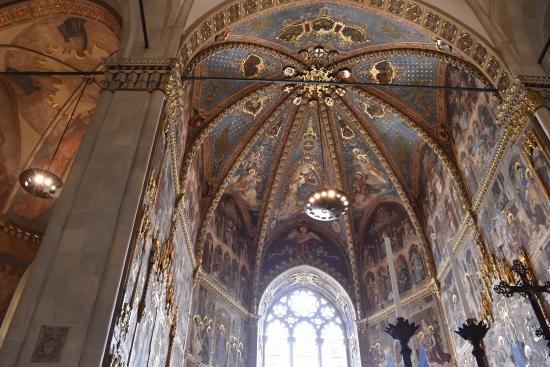
Where is `filigree detail`? The image size is (550, 367). filigree detail is located at coordinates (159, 258), (512, 122).